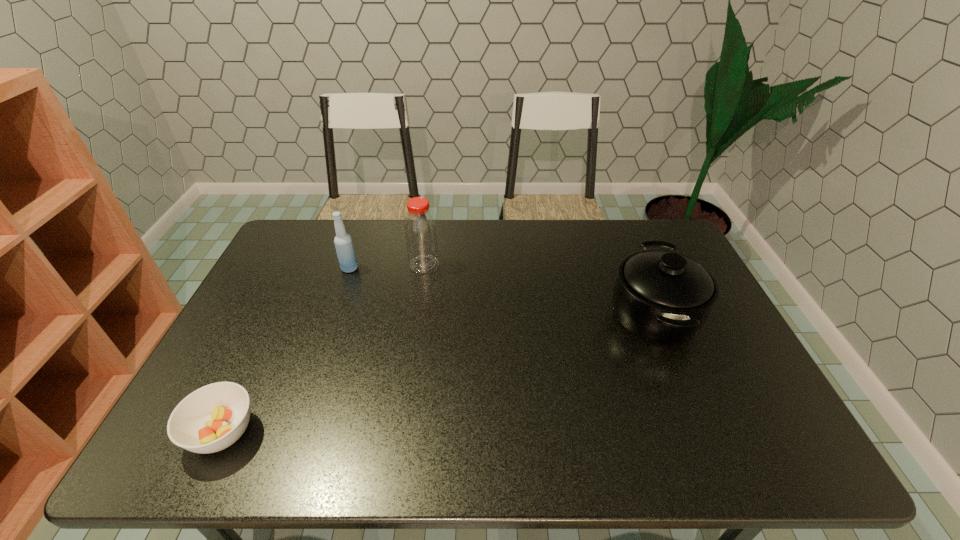
The image size is (960, 540). I want to click on object that can be found as the third closest to the right bottle, so click(213, 417).

At what (x,y) coordinates should I click in order to perform the action: click on vacant position in the image that satisfies the following two spatial constraints: 1. on the back side of the nearest object; 2. on the left side of the right bottle. Please return your answer as a coordinate pair (x, y). This screenshot has height=540, width=960. Looking at the image, I should click on (302, 265).

I want to click on vacant area in the image that satisfies the following two spatial constraints: 1. on the back side of the shortest object; 2. on the left side of the saucepan, so click(x=279, y=314).

This screenshot has width=960, height=540. I want to click on free region that satisfies the following two spatial constraints: 1. on the back side of the right bottle; 2. on the left side of the nearest object, so click(x=302, y=265).

Locate an element on the screen. vacant space that satisfies the following two spatial constraints: 1. on the back side of the nearest object; 2. on the left side of the saucepan is located at coordinates (279, 314).

The image size is (960, 540). Find the location of `free point that satisfies the following two spatial constraints: 1. on the front side of the rightmost object; 2. on the right side of the left bottle`. free point that satisfies the following two spatial constraints: 1. on the front side of the rightmost object; 2. on the right side of the left bottle is located at coordinates (334, 314).

This screenshot has height=540, width=960. In order to click on free space that satisfies the following two spatial constraints: 1. on the front side of the saucepan; 2. on the right side of the third object from right to left in this screenshot , I will do `click(334, 314)`.